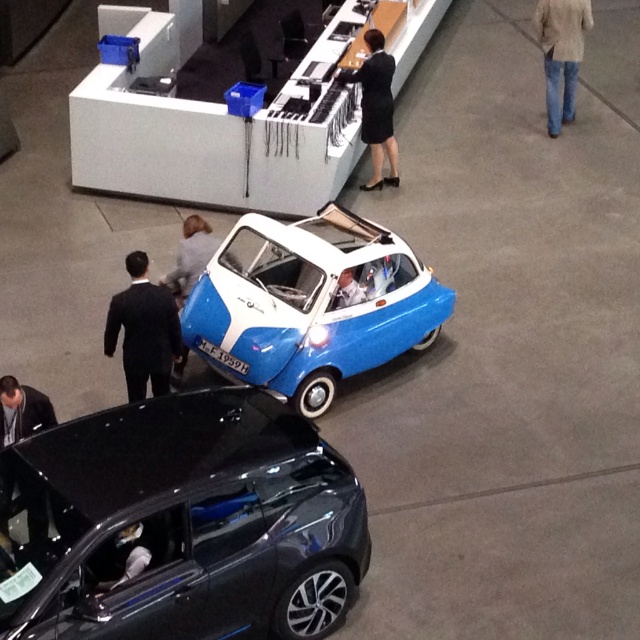
Looking at this image, who is shorter, black suit at left or black leather jacket at lower left?

With less height is black leather jacket at lower left.

Is black suit at left thinner than black leather jacket at lower left?

No.

Which is in front, point (152, 310) or point (35, 529)?

Point (35, 529) is more forward.

Where is `black suit at left`? black suit at left is located at coordinates (144, 330).

Can you confirm if jeans at center is positioned above black leather jacket at lower left?

Yes.

Who is more forward, (x=550, y=35) or (x=10, y=406)?

Point (x=10, y=406) is in front.

Where is `jeans at center`? This screenshot has height=640, width=640. jeans at center is located at coordinates (561, 52).

Is light gray fabric jacket at center closer to the viewer compared to white fabric person at center?

That is False.

Consider the image. Between light gray fabric jacket at center and white fabric person at center, which one has more height?

light gray fabric jacket at center is taller.

Between point (198, 220) and point (355, 282), which one is positioned behind?

Positioned behind is point (198, 220).

Identify the location of light gray fabric jacket at center. Image resolution: width=640 pixels, height=640 pixels. pos(189,257).